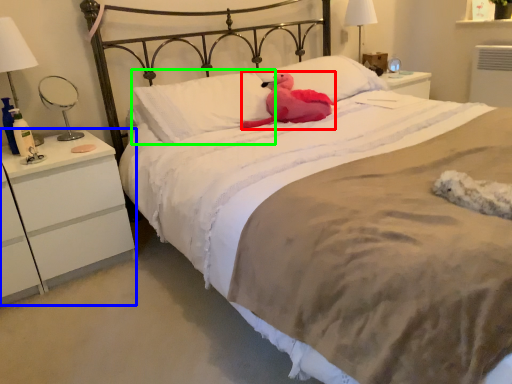
Question: Which is farther away from animal (highlighted by a red box)? nightstand (highlighted by a blue box) or pillow (highlighted by a green box)?

Choices:
 (A) nightstand
 (B) pillow

Answer: (A)